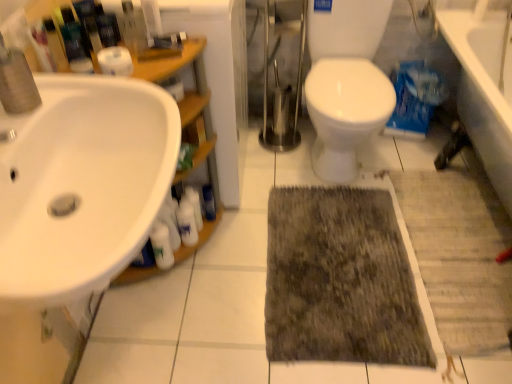
Where is `vacant space behind dark gray shaggy rug at center`? vacant space behind dark gray shaggy rug at center is located at coordinates (320, 159).